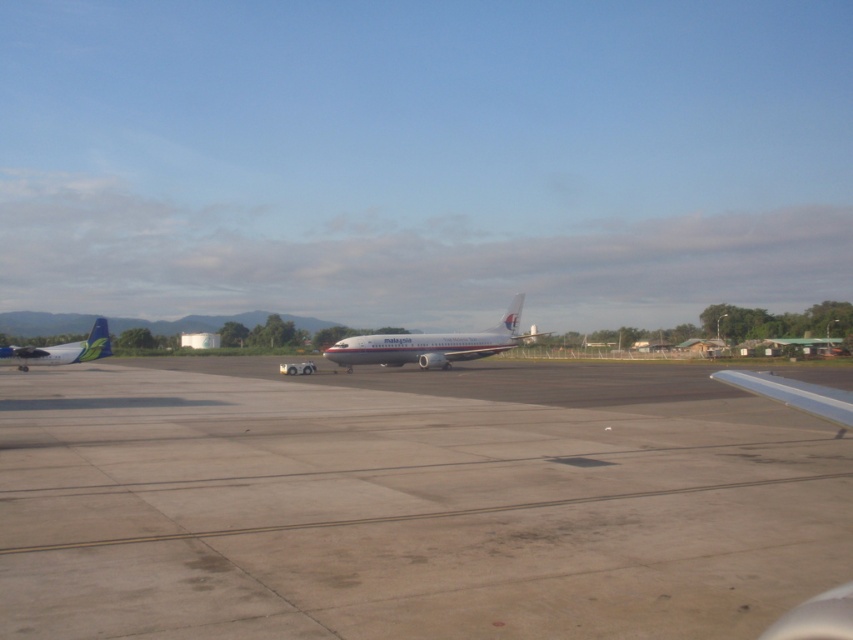
Who is higher up, gray concrete runway at center or matte white airplane at left?

matte white airplane at left

Image resolution: width=853 pixels, height=640 pixels. Identify the location of gray concrete runway at center. (410, 504).

Is point (520, 305) positioned after point (79, 346)?

Yes, it is.

Who is positioned more to the left, white metallic airplane at center or matte white airplane at left?

Positioned to the left is matte white airplane at left.

Who is more forward, (416,344) or (39,364)?

Point (416,344) is in front.

Find the location of a particular element. This screenshot has width=853, height=640. white metallic airplane at center is located at coordinates (428, 344).

Does gray concrete runway at center appear under white metallic airplane at center?

Yes.

Can you confirm if gray concrete runway at center is positioned to the right of white metallic airplane at center?

Indeed, gray concrete runway at center is positioned on the right side of white metallic airplane at center.

This screenshot has height=640, width=853. What are the coordinates of `gray concrete runway at center` in the screenshot? It's located at (410, 504).

At what (x,y) coordinates should I click in order to perform the action: click on gray concrete runway at center. Please return your answer as a coordinate pair (x, y). The image size is (853, 640). Looking at the image, I should click on pos(410,504).